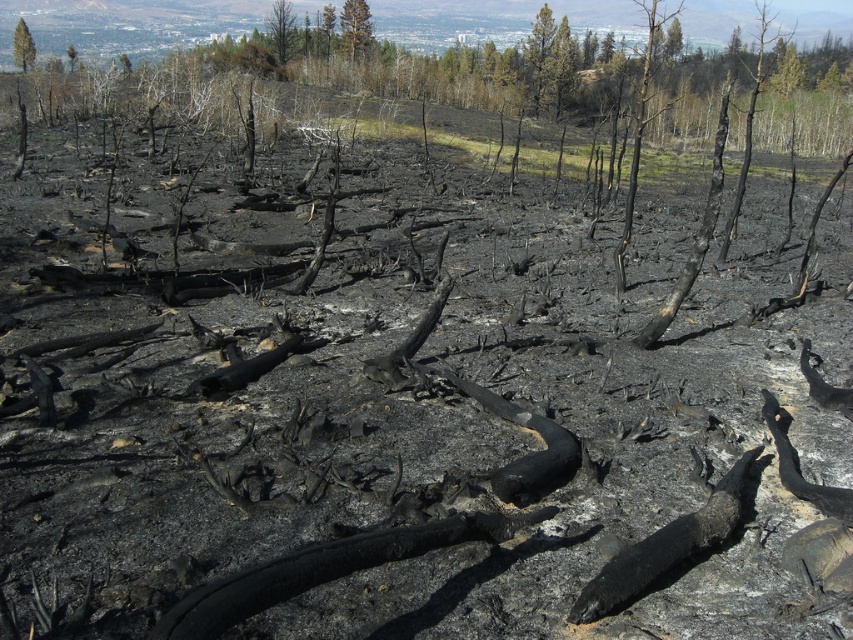
Consider the image. You are a firefighter assessing the fire damage. You notice the charcoal bark tree at upper center and the charred wood tree at upper left. Which tree appears larger in size?

The charcoal bark tree at upper center is bigger than the charred wood tree at upper left, so it appears larger in size.

You are standing at the point with coordinates point (x=71, y=60) and want to walk to the point with coordinates point (x=619, y=243). Which direction should you move in to reach your destination?

You should move forward because point (x=619, y=243) is in front of point (x=71, y=60).

You are a firefighter assessing the fire damage. You notice the green matte tree at upper center and the charred wood tree at upper left in the distance. Which tree appears taller from your vantage point?

The green matte tree at upper center appears taller than the charred wood tree at upper left.